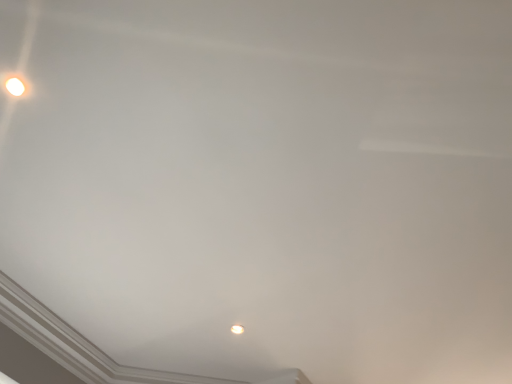
Question: From the image's perspective, relative to matte white lamp at upper left, the first lamp in the top-to-bottom sequence, is matte white lamp at center, the second lamp from the front, above or below?

Choices:
 (A) below
 (B) above

Answer: (A)

Question: In terms of width, does matte white lamp at center, the second lamp from the front, look wider or thinner when compared to matte white lamp at upper left, acting as the second lamp starting from the right?

Choices:
 (A) wide
 (B) thin

Answer: (A)

Question: From a real-world perspective, relative to matte white lamp at upper left, which is the second lamp from back to front, is matte white lamp at center, positioned as the second lamp in top-to-bottom order, vertically above or below?

Choices:
 (A) below
 (B) above

Answer: (B)

Question: Considering the positions of matte white lamp at upper left, which ranks as the first lamp in left-to-right order, and matte white lamp at center, the first lamp viewed from the back, in the image, is matte white lamp at upper left, which ranks as the first lamp in left-to-right order, taller or shorter than matte white lamp at center, the first lamp viewed from the back,?

Choices:
 (A) tall
 (B) short

Answer: (A)

Question: From the image's perspective, is matte white lamp at upper left, which ranks as the first lamp in left-to-right order, above or below matte white lamp at center, acting as the 1th lamp starting from the bottom?

Choices:
 (A) below
 (B) above

Answer: (B)

Question: From a real-world perspective, is matte white lamp at upper left, which ranks as the first lamp in left-to-right order, above or below matte white lamp at center, acting as the 1th lamp starting from the bottom?

Choices:
 (A) above
 (B) below

Answer: (B)

Question: Considering the positions of matte white lamp at upper left, positioned as the first lamp in front-to-back order, and matte white lamp at center, which is the second lamp in left-to-right order, in the image, is matte white lamp at upper left, positioned as the first lamp in front-to-back order, wider or thinner than matte white lamp at center, which is the second lamp in left-to-right order,?

Choices:
 (A) thin
 (B) wide

Answer: (A)